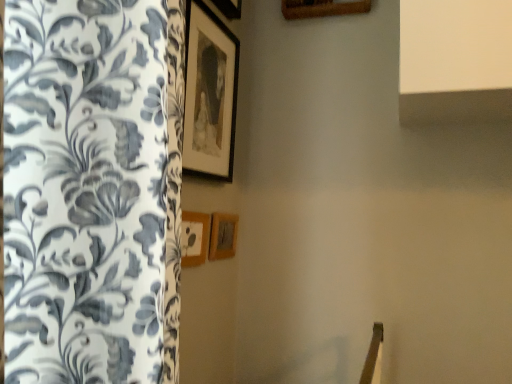
Image resolution: width=512 pixels, height=384 pixels. Identify the location of wooden picture frame at center, which is the third picture frame from top to bottom. (223, 236).

Where is `matte black picture frame at upper center, the 3th picture frame ordered from the bottom`? matte black picture frame at upper center, the 3th picture frame ordered from the bottom is located at coordinates pyautogui.click(x=209, y=94).

Is matte black picture frame at upper center, the 3th picture frame ordered from the bottom, wider or thinner than wooden picture frame at center, which ranks as the second picture frame in top-to-bottom order?

Considering their sizes, matte black picture frame at upper center, the 3th picture frame ordered from the bottom, looks broader than wooden picture frame at center, which ranks as the second picture frame in top-to-bottom order.

Considering their positions, is matte black picture frame at upper center, which is the first picture frame in top-to-bottom order, located in front of or behind wooden picture frame at center, which is the 2th picture frame in bottom-to-top order?

Clearly, matte black picture frame at upper center, which is the first picture frame in top-to-bottom order, is in front of wooden picture frame at center, which is the 2th picture frame in bottom-to-top order.

Does matte black picture frame at upper center, the 3th picture frame ordered from the bottom, appear on the left side of wooden picture frame at center, which is the 2th picture frame in bottom-to-top order?

In fact, matte black picture frame at upper center, the 3th picture frame ordered from the bottom, is to the right of wooden picture frame at center, which is the 2th picture frame in bottom-to-top order.

Does point (230, 253) come behind point (230, 137)?

Yes, point (230, 253) is behind point (230, 137).

Consider the image. Is wooden picture frame at center, which is the third picture frame from top to bottom, positioned in front of matte black picture frame at upper center, which is the first picture frame in top-to-bottom order?

No, wooden picture frame at center, which is the third picture frame from top to bottom, is further to the viewer.

Is wooden picture frame at center, the 1th picture frame in the bottom-to-top sequence, with matte black picture frame at upper center, the 3th picture frame ordered from the bottom?

wooden picture frame at center, the 1th picture frame in the bottom-to-top sequence, and matte black picture frame at upper center, the 3th picture frame ordered from the bottom, are clearly separated.

In the scene shown: Considering the sizes of objects wooden picture frame at center, the 1th picture frame in the bottom-to-top sequence, and matte black picture frame at upper center, the 3th picture frame ordered from the bottom, in the image provided, who is smaller, wooden picture frame at center, the 1th picture frame in the bottom-to-top sequence, or matte black picture frame at upper center, the 3th picture frame ordered from the bottom,?

Smaller between the two is wooden picture frame at center, the 1th picture frame in the bottom-to-top sequence.

In the scene shown: Is matte black picture frame at upper center, the 3th picture frame ordered from the bottom, positioned with its back to wooden picture frame at center, which is the third picture frame from top to bottom?

That's not correct — matte black picture frame at upper center, the 3th picture frame ordered from the bottom, is not looking away from wooden picture frame at center, which is the third picture frame from top to bottom.

From the image's perspective, starting from the matte black picture frame at upper center, which is the first picture frame in top-to-bottom order, which picture frame is the 2nd one below? Please provide its 2D coordinates.

[(223, 236)]

Can you confirm if matte black picture frame at upper center, the 3th picture frame ordered from the bottom, is positioned to the right of wooden picture frame at center, the 1th picture frame in the bottom-to-top sequence?

In fact, matte black picture frame at upper center, the 3th picture frame ordered from the bottom, is to the left of wooden picture frame at center, the 1th picture frame in the bottom-to-top sequence.

From the picture: How many degrees apart are the facing directions of matte black picture frame at upper center, the 3th picture frame ordered from the bottom, and wooden picture frame at center, the 1th picture frame in the bottom-to-top sequence?

matte black picture frame at upper center, the 3th picture frame ordered from the bottom, and wooden picture frame at center, the 1th picture frame in the bottom-to-top sequence, are facing 0.299 degrees away from each other.

Can you confirm if wooden picture frame at center, which is the third picture frame from top to bottom, is positioned to the left of wooden picture frame at center, which is the 2th picture frame in bottom-to-top order?

In fact, wooden picture frame at center, which is the third picture frame from top to bottom, is to the right of wooden picture frame at center, which is the 2th picture frame in bottom-to-top order.

Locate an element on the screen. The image size is (512, 384). picture frame below the wooden picture frame at center, which is the 2th picture frame in bottom-to-top order (from a real-world perspective) is located at coordinates (223, 236).

Considering the sizes of objects wooden picture frame at center, which is the third picture frame from top to bottom, and wooden picture frame at center, which ranks as the second picture frame in top-to-bottom order, in the image provided, who is bigger, wooden picture frame at center, which is the third picture frame from top to bottom, or wooden picture frame at center, which ranks as the second picture frame in top-to-bottom order,?

wooden picture frame at center, which is the third picture frame from top to bottom.

Could you tell me if wooden picture frame at center, the 1th picture frame in the bottom-to-top sequence, is turned towards wooden picture frame at center, which is the 2th picture frame in bottom-to-top order?

No, wooden picture frame at center, the 1th picture frame in the bottom-to-top sequence, is not oriented towards wooden picture frame at center, which is the 2th picture frame in bottom-to-top order.

Find the location of a particular element. The image size is (512, 384). the 2nd picture frame counting from the left side of the wooden picture frame at center, the 1th picture frame in the bottom-to-top sequence is located at coordinates (194, 238).

Does point (206, 240) come closer to viewer compared to point (214, 256)?

Yes, it is.

In the scene shown: Can you confirm if wooden picture frame at center, which is the 2th picture frame in bottom-to-top order, is positioned to the left of wooden picture frame at center, which is the third picture frame from top to bottom?

Yes.

Looking at this image, is wooden picture frame at center, which ranks as the second picture frame in top-to-bottom order, turned away from wooden picture frame at center, the 1th picture frame in the bottom-to-top sequence?

No, wooden picture frame at center, the 1th picture frame in the bottom-to-top sequence, is not at the back of wooden picture frame at center, which ranks as the second picture frame in top-to-bottom order.

Between wooden picture frame at center, which ranks as the second picture frame in top-to-bottom order, and matte black picture frame at upper center, which is the first picture frame in top-to-bottom order, which one has more height?

Standing taller between the two is matte black picture frame at upper center, which is the first picture frame in top-to-bottom order.

Can matte black picture frame at upper center, the 3th picture frame ordered from the bottom, be found inside wooden picture frame at center, which ranks as the second picture frame in top-to-bottom order?

No, matte black picture frame at upper center, the 3th picture frame ordered from the bottom, is located outside of wooden picture frame at center, which ranks as the second picture frame in top-to-bottom order.

From the image's perspective, which object appears higher, wooden picture frame at center, which is the 2th picture frame in bottom-to-top order, or matte black picture frame at upper center, the 3th picture frame ordered from the bottom?

matte black picture frame at upper center, the 3th picture frame ordered from the bottom.

The image size is (512, 384). Find the location of `the 1st picture frame below the matte black picture frame at upper center, the 3th picture frame ordered from the bottom (from the image's perspective)`. the 1st picture frame below the matte black picture frame at upper center, the 3th picture frame ordered from the bottom (from the image's perspective) is located at coordinates (x=194, y=238).

Identify the location of picture frame that is above the wooden picture frame at center, which is the 2th picture frame in bottom-to-top order (from the image's perspective). (209, 94).

Which picture frame is the 2nd one when counting from the front of the wooden picture frame at center, the 1th picture frame in the bottom-to-top sequence? Please provide its 2D coordinates.

[(209, 94)]

Considering their positions, is matte black picture frame at upper center, which is the first picture frame in top-to-bottom order, positioned further to wooden picture frame at center, which ranks as the second picture frame in top-to-bottom order, than wooden picture frame at center, which is the third picture frame from top to bottom?

Based on the image, matte black picture frame at upper center, which is the first picture frame in top-to-bottom order, appears to be further to wooden picture frame at center, which ranks as the second picture frame in top-to-bottom order.

Consider the image. Based on their spatial positions, is wooden picture frame at center, which is the third picture frame from top to bottom, or matte black picture frame at upper center, which is the first picture frame in top-to-bottom order, further from wooden picture frame at center, which ranks as the second picture frame in top-to-bottom order?

matte black picture frame at upper center, which is the first picture frame in top-to-bottom order.

When comparing their distances from wooden picture frame at center, the 1th picture frame in the bottom-to-top sequence, does matte black picture frame at upper center, which is the first picture frame in top-to-bottom order, or wooden picture frame at center, which ranks as the second picture frame in top-to-bottom order, seem closer?

Among the two, wooden picture frame at center, which ranks as the second picture frame in top-to-bottom order, is located nearer to wooden picture frame at center, the 1th picture frame in the bottom-to-top sequence.

Considering their positions, is wooden picture frame at center, which ranks as the second picture frame in top-to-bottom order, positioned closer to wooden picture frame at center, the 1th picture frame in the bottom-to-top sequence, than matte black picture frame at upper center, the 3th picture frame ordered from the bottom?

Based on the image, wooden picture frame at center, which ranks as the second picture frame in top-to-bottom order, appears to be nearer to wooden picture frame at center, the 1th picture frame in the bottom-to-top sequence.

Looking at the image, which one is located closer to matte black picture frame at upper center, which is the first picture frame in top-to-bottom order, wooden picture frame at center, the 1th picture frame in the bottom-to-top sequence, or wooden picture frame at center, which ranks as the second picture frame in top-to-bottom order?

wooden picture frame at center, which ranks as the second picture frame in top-to-bottom order, is positioned closer to the anchor matte black picture frame at upper center, which is the first picture frame in top-to-bottom order.

Considering their positions, is wooden picture frame at center, which ranks as the second picture frame in top-to-bottom order, positioned closer to matte black picture frame at upper center, the 3th picture frame ordered from the bottom, than wooden picture frame at center, which is the third picture frame from top to bottom?

wooden picture frame at center, which ranks as the second picture frame in top-to-bottom order, lies closer to matte black picture frame at upper center, the 3th picture frame ordered from the bottom, than the other object.

Identify the location of picture frame that lies between matte black picture frame at upper center, which is the first picture frame in top-to-bottom order, and wooden picture frame at center, which is the third picture frame from top to bottom, from top to bottom. The image size is (512, 384). (194, 238).